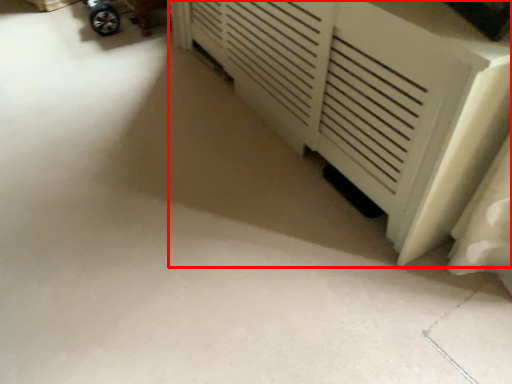
Question: From the image, what is the correct spatial relationship of furniture (annotated by the red box) in relation to wheel?

Choices:
 (A) left
 (B) right

Answer: (B)